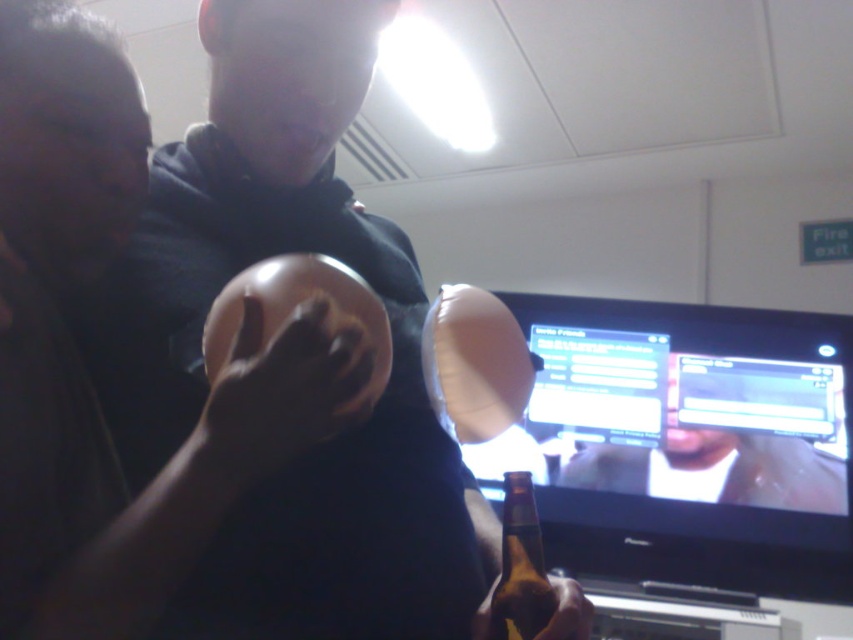
Question: Is the position of matte brown helmet at center more distant than that of brown glass bottle at lower center?

Choices:
 (A) yes
 (B) no

Answer: (B)

Question: Which object is positioned farthest from the matte brown helmet at center?

Choices:
 (A) matte plastic monitor at center
 (B) brown glass bottle at lower center

Answer: (A)

Question: Is matte plastic monitor at center in front of smooth leather jacket at upper right?

Choices:
 (A) no
 (B) yes

Answer: (B)

Question: Is matte plastic monitor at center closer to the viewer compared to smooth leather jacket at upper right?

Choices:
 (A) yes
 (B) no

Answer: (A)

Question: Which object appears farthest from the camera in this image?

Choices:
 (A) brown glass bottle at lower center
 (B) matte plastic monitor at center

Answer: (B)

Question: Based on their relative distances, which object is nearer to the matte brown helmet at center?

Choices:
 (A) matte plastic monitor at center
 (B) smooth leather jacket at upper right
 (C) brown glass bottle at lower center

Answer: (C)